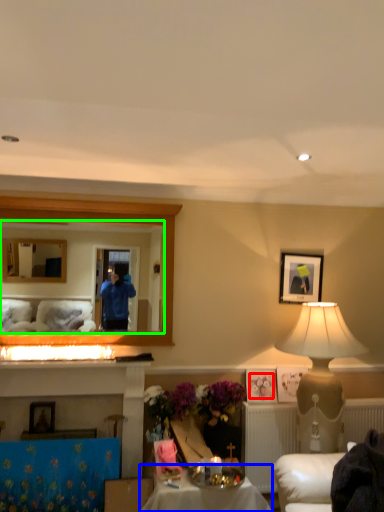
Question: Estimate the real-world distances between objects in this image. Which object is closer to flower (highlighted by a red box), table (highlighted by a blue box) or mirror (highlighted by a green box)?

Choices:
 (A) table
 (B) mirror

Answer: (A)